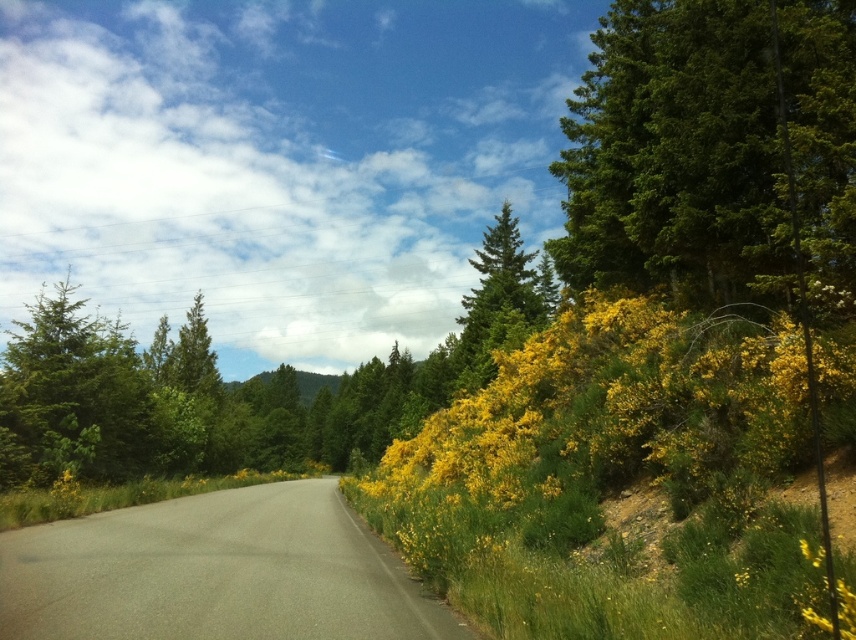
Who is taller, green glossy tree at upper right or green textured pine tree at center?

With more height is green textured pine tree at center.

Does green glossy tree at upper right come behind green textured pine tree at center?

No, it is in front of green textured pine tree at center.

At what (x,y) coordinates should I click in order to perform the action: click on green glossy tree at upper right. Please return your answer as a coordinate pair (x, y). The height and width of the screenshot is (640, 856). Looking at the image, I should click on (676, 156).